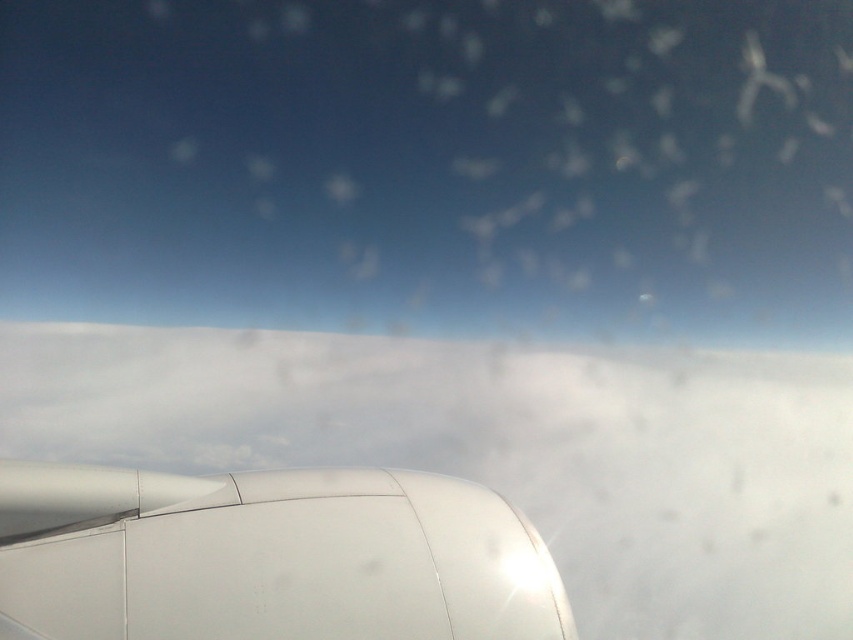
Which is in front, point (483, 353) or point (164, 547)?

Positioned in front is point (164, 547).

Is point (28, 400) closer to camera compared to point (467, 531)?

No, (28, 400) is behind (467, 531).

Which is in front, point (651, 460) or point (492, 577)?

Point (492, 577) is more forward.

The width and height of the screenshot is (853, 640). Find the location of `white matte cloud at center`. white matte cloud at center is located at coordinates (502, 449).